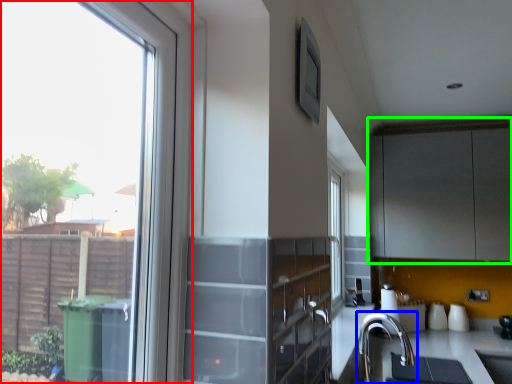
Question: Estimate the real-world distances between objects in this image. Which object is closer to window (highlighted by a red box), tap (highlighted by a blue box) or cabinetry (highlighted by a green box)?

Choices:
 (A) tap
 (B) cabinetry

Answer: (A)